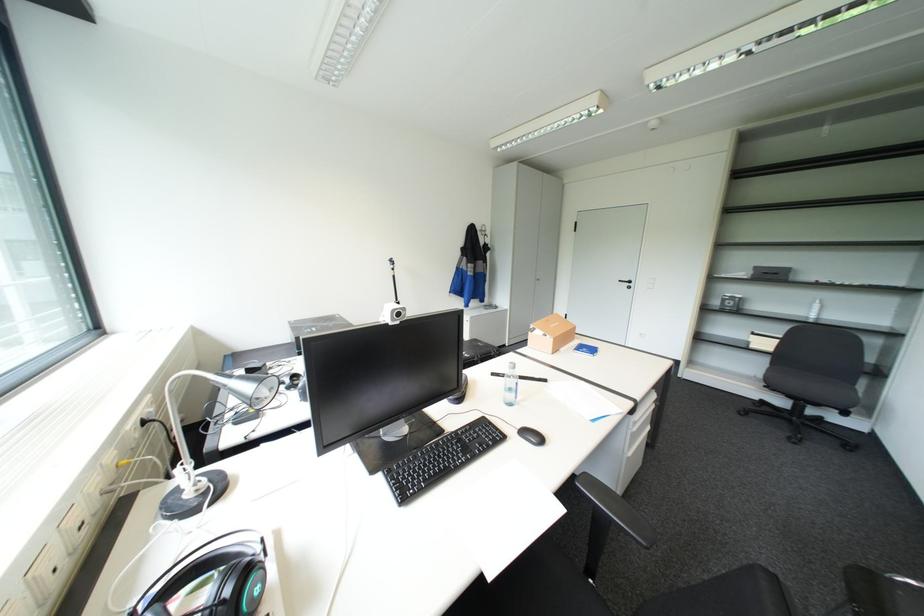
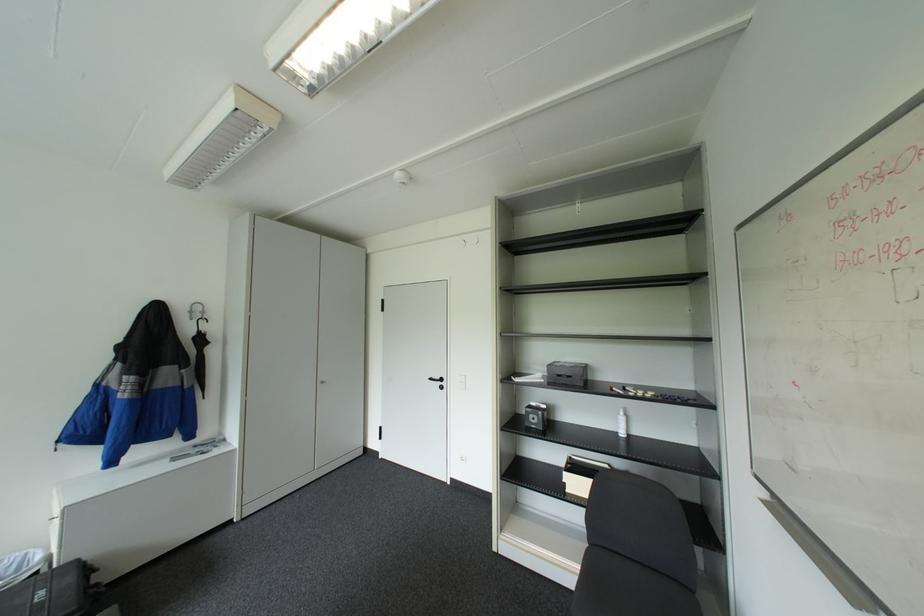
Where in the second image is the point corresponding to point 737,302 from the first image?

(541, 416)